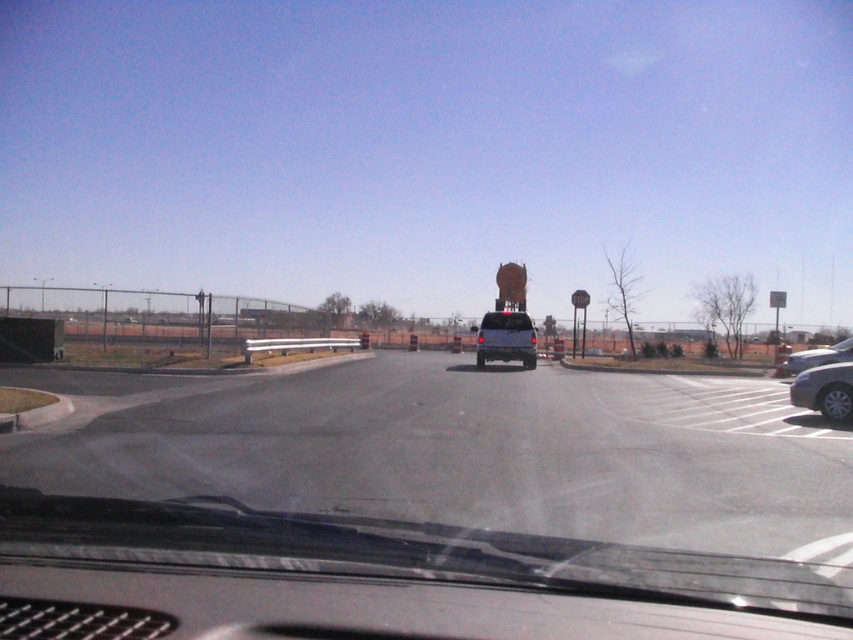
Can you confirm if transparent glass windshield at center is wider than matte black suv at center?

Correct, the width of transparent glass windshield at center exceeds that of matte black suv at center.

Can you confirm if transparent glass windshield at center is positioned below matte black suv at center?

Indeed, transparent glass windshield at center is positioned under matte black suv at center.

This screenshot has height=640, width=853. Describe the element at coordinates (434, 502) in the screenshot. I see `transparent glass windshield at center` at that location.

At what (x,y) coordinates should I click in order to perform the action: click on transparent glass windshield at center. Please return your answer as a coordinate pair (x, y). The width and height of the screenshot is (853, 640). Looking at the image, I should click on (434, 502).

Between transparent glass windshield at center and silver metallic sedan at right, which one has more height?

silver metallic sedan at right

Is transparent glass windshield at center shorter than silver metallic sedan at right?

Correct, transparent glass windshield at center is not as tall as silver metallic sedan at right.

This screenshot has width=853, height=640. What are the coordinates of `transparent glass windshield at center` in the screenshot? It's located at (434, 502).

From the picture: Can you confirm if silver metallic sedan at lower right is positioned above silver metallic sedan at right?

Incorrect, silver metallic sedan at lower right is not positioned above silver metallic sedan at right.

Is point (833, 374) less distant than point (784, 364)?

Yes, it is.

Locate an element on the screen. This screenshot has width=853, height=640. silver metallic sedan at lower right is located at coordinates [825, 390].